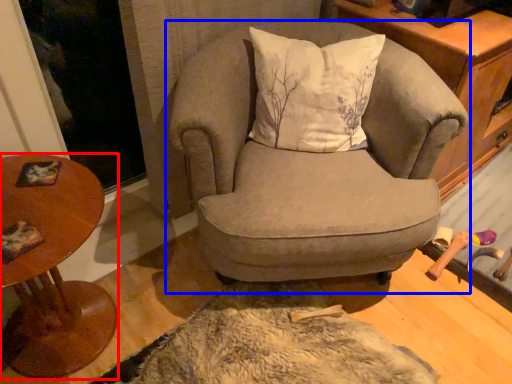
Question: Which of the following is the farthest to the observer, table (highlighted by a red box) or chair (highlighted by a blue box)?

Choices:
 (A) table
 (B) chair

Answer: (B)